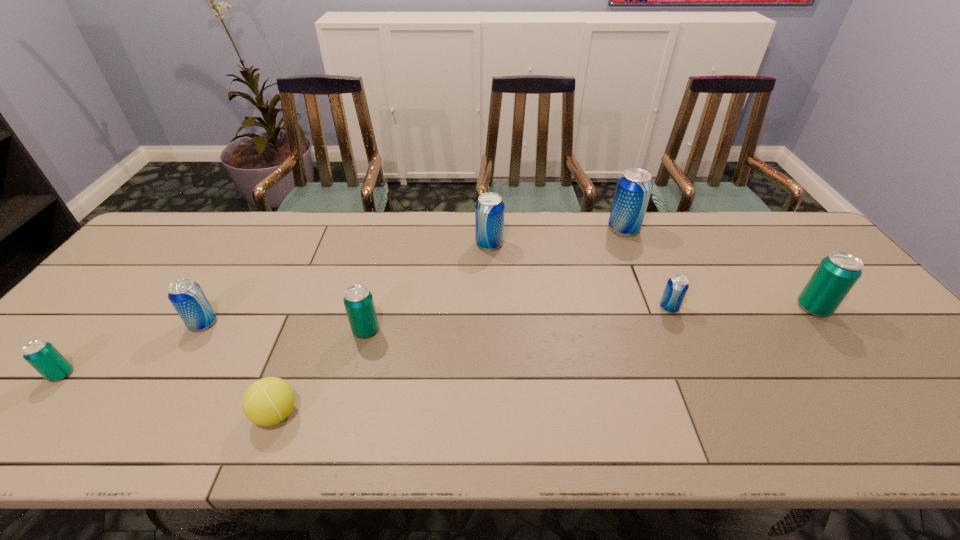
I want to click on the biggest blue beer can, so click(x=633, y=190).

You are a GUI agent. You are given a task and a screenshot of the screen. Output one action in this format:
    pyautogui.click(x=<x>, y=<y>)
    Task: Click on the tallest beer can
    The width and height of the screenshot is (960, 540).
    Given the screenshot: What is the action you would take?
    pyautogui.click(x=633, y=190)

I want to click on the fourth object from right to left, so click(x=489, y=209).

Locate an element on the screen. This screenshot has width=960, height=540. the third smallest blue beer can is located at coordinates (489, 209).

You are a GUI agent. You are given a task and a screenshot of the screen. Output one action in this format:
    pyautogui.click(x=<x>, y=<y>)
    Task: Click on the rightmost beer can
    Image resolution: width=960 pixels, height=540 pixels.
    Given the screenshot: What is the action you would take?
    tap(835, 276)

Locate an element on the screen. The height and width of the screenshot is (540, 960). the biggest teal beer can is located at coordinates (835, 276).

The width and height of the screenshot is (960, 540). Identify the location of the second smallest teal beer can. (358, 300).

This screenshot has width=960, height=540. Identify the location of the fifth object from right to left. (358, 300).

This screenshot has width=960, height=540. In order to click on the leftmost blue beer can in this screenshot , I will do `click(186, 296)`.

The image size is (960, 540). Identify the location of the second smallest blue beer can. (186, 296).